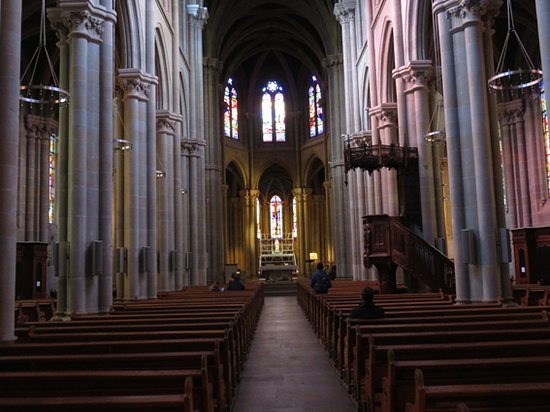
Where is `altar`? This screenshot has width=550, height=412. altar is located at coordinates (275, 257).